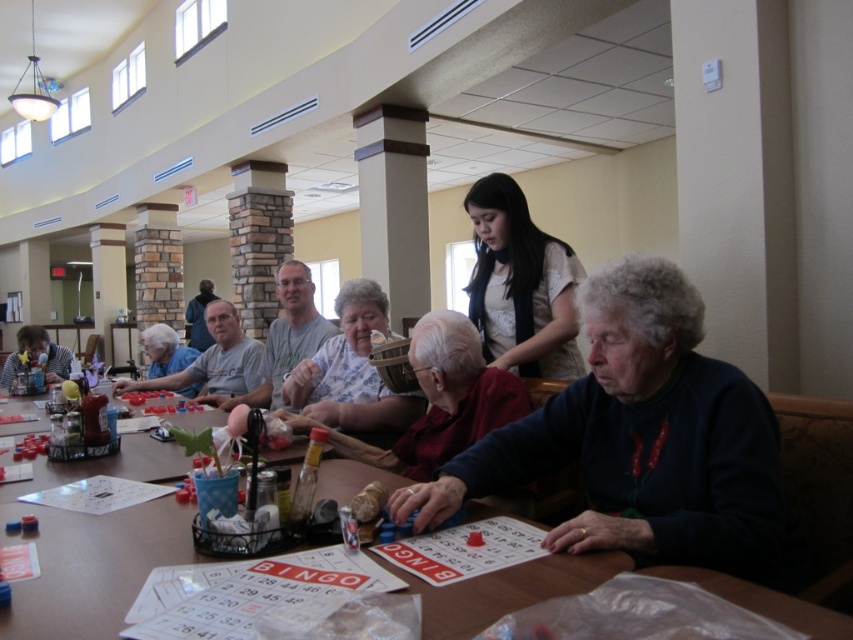
Question: Which point is farther to the camera?

Choices:
 (A) wooden table at center
 (B) floral fabric basket at center
 (C) white lace blouse at upper center

Answer: (B)

Question: Based on their relative distances, which object is farther from the gray fabric shirt at center?

Choices:
 (A) matte blue shirt at center
 (B) light blue shirt at center
 (C) white lace blouse at upper center

Answer: (C)

Question: Which of the following is the farthest from the observer?

Choices:
 (A) floral fabric shirt at center
 (B) wooden table at center
 (C) floral fabric basket at center

Answer: (C)

Question: Can you confirm if matte plastic cup at lower left is wider than matte blue shirt at center?

Choices:
 (A) yes
 (B) no

Answer: (A)

Question: Does floral fabric basket at center have a larger size compared to matte black shirt at upper center?

Choices:
 (A) no
 (B) yes

Answer: (A)

Question: Does floral fabric shirt at center appear on the left side of light blue shirt at center?

Choices:
 (A) yes
 (B) no

Answer: (B)